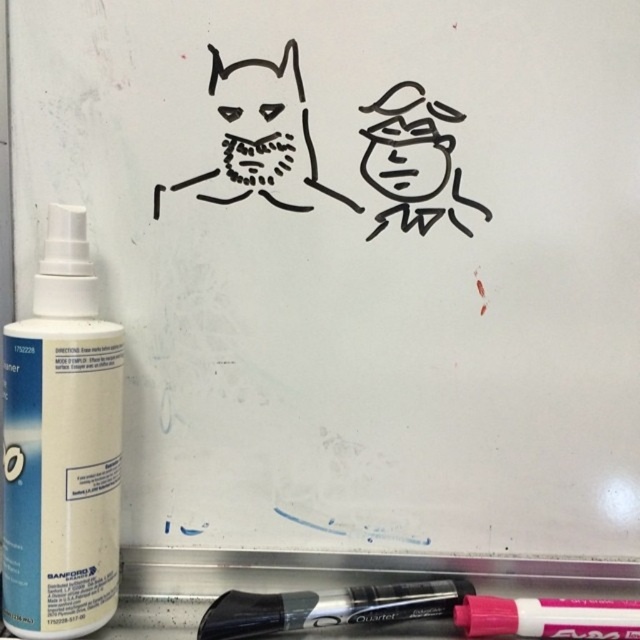
From the picture: Measure the distance between white plastic spray bottle at left and camera.

A distance of 37.04 inches exists between white plastic spray bottle at left and camera.

Does white plastic spray bottle at left have a lesser height compared to black matte marker at lower center?

No.

Does point (88, 476) lie behind point (248, 632)?

That is False.

Find the location of a particular element. white plastic spray bottle at left is located at coordinates (61, 445).